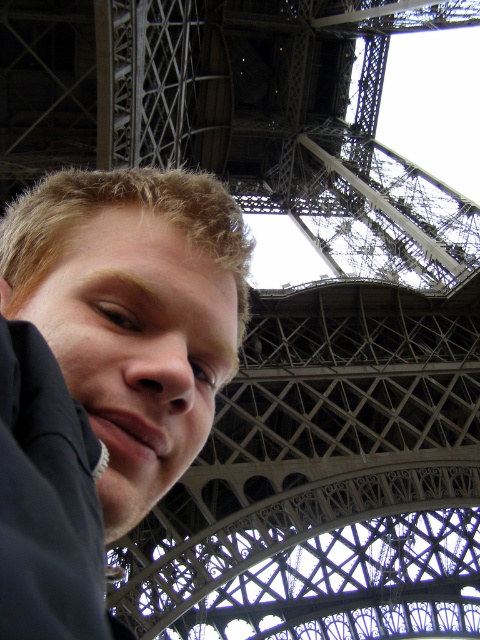
You are a photographer trying to capture the perfect shot of the Eiffel Tower. You notice two elements in the frame, the matte black hair at lower left and the metallic gray lattice structure at center. Which object is positioned more to the left side of the frame?

The matte black hair at lower left is positioned more to the left side of the frame than the metallic gray lattice structure at center.